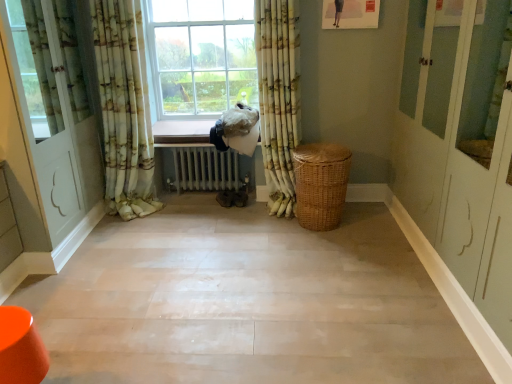
Find the location of a particular element. This screenshot has height=384, width=512. free location in front of woven brown basket at center-right is located at coordinates (319, 251).